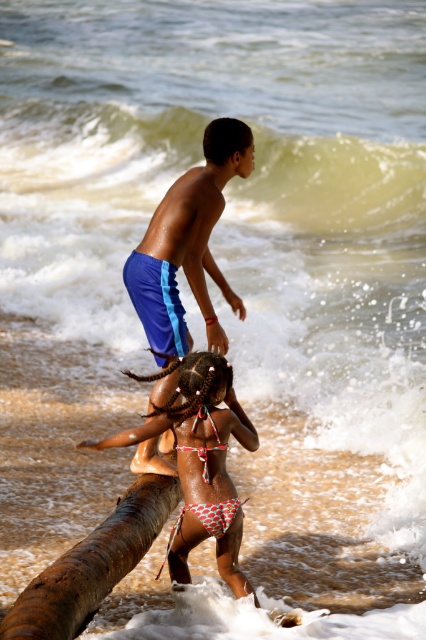
Question: Does blue fabric shorts at upper center appear on the right side of brown rough tree trunk at lower left?

Choices:
 (A) yes
 (B) no

Answer: (A)

Question: Which point is farther from the camera taking this photo?

Choices:
 (A) (172, 381)
 (B) (60, 556)
 (C) (344, 168)
 (D) (181, 548)

Answer: (C)

Question: Does greenish frothy wave at upper center have a larger size compared to polka dot bikini at center?

Choices:
 (A) yes
 (B) no

Answer: (A)

Question: From the image, what is the correct spatial relationship of blue fabric shorts at upper center in relation to brown rough tree trunk at lower left?

Choices:
 (A) right
 (B) left

Answer: (A)

Question: Which point appears farthest from the camera in this image?

Choices:
 (A) (48, 566)
 (B) (155, 456)
 (C) (195, 416)

Answer: (B)

Question: Which of the following is the farthest from the observer?

Choices:
 (A) pyautogui.click(x=184, y=266)
 (B) pyautogui.click(x=181, y=516)

Answer: (A)